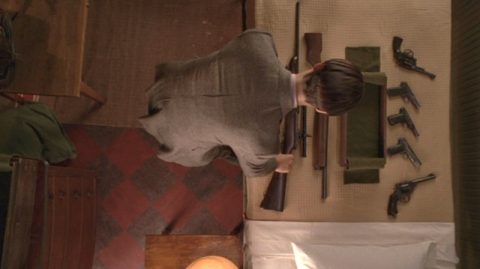
The height and width of the screenshot is (269, 480). In order to click on sheet in this screenshot , I will do `click(265, 245)`.